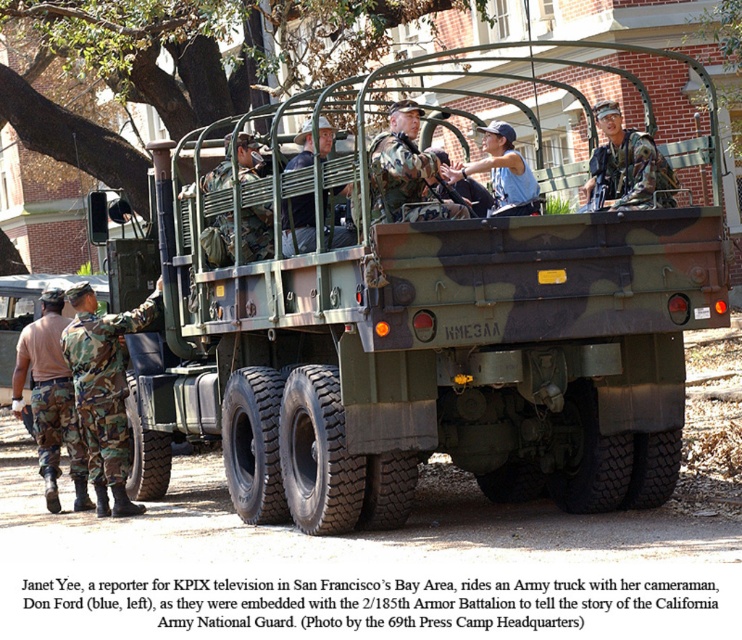
Measure the distance from camo fabric truck at center to camouflage uniform at center.

They are 6.82 feet apart.

This screenshot has height=640, width=742. What are the coordinates of `camo fabric truck at center` in the screenshot? It's located at (413, 326).

Can you confirm if camouflage uniform at center is wider than blue cotton shirt at center?

In fact, camouflage uniform at center might be narrower than blue cotton shirt at center.

In order to click on camouflage uniform at center in this screenshot , I will do `click(404, 172)`.

Who is higher up, camo fabric truck at center or blue cotton shirt at center?

camo fabric truck at center

Which is in front, point (462, 419) or point (512, 182)?

Point (462, 419) is more forward.

Locate an element on the screen. Image resolution: width=742 pixels, height=640 pixels. camo fabric truck at center is located at coordinates (413, 326).